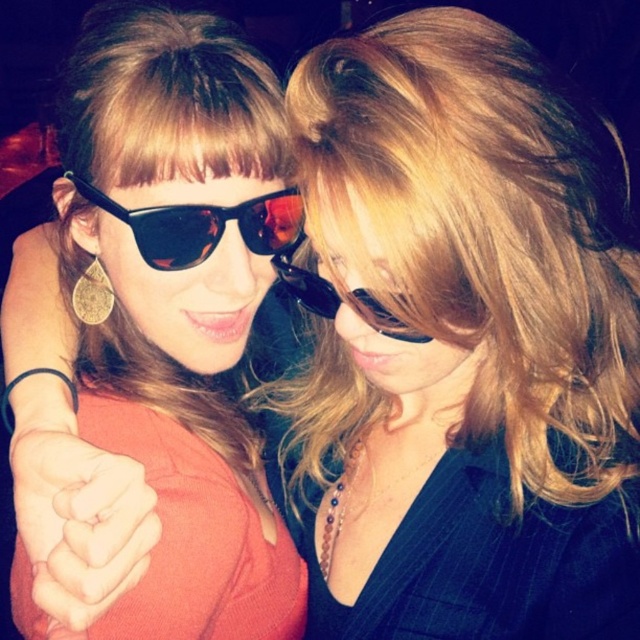
Is point (40, 516) closer to viewer compared to point (164, 253)?

Yes, it is.

Is smooth skin fist at center to the left of black reflective sunglasses at center from the viewer's perspective?

Correct, you'll find smooth skin fist at center to the left of black reflective sunglasses at center.

Between point (56, 605) and point (298, 196), which one is positioned behind?

The point (298, 196) is behind.

This screenshot has height=640, width=640. What are the coordinates of `smooth skin fist at center` in the screenshot? It's located at pyautogui.click(x=80, y=520).

Is the position of matte black sunglasses at upper left less distant than that of black reflective sunglasses at center?

That is True.

Can you confirm if matte black sunglasses at upper left is shorter than black reflective sunglasses at center?

No.

Does point (80, 188) come closer to viewer compared to point (257, 220)?

Yes, point (80, 188) is closer to viewer.

This screenshot has width=640, height=640. Find the location of `matte black sunglasses at upper left`. matte black sunglasses at upper left is located at coordinates (179, 305).

Is matte black sunglasses at upper left to the right of black plastic sunglasses at center from the viewer's perspective?

No, matte black sunglasses at upper left is not to the right of black plastic sunglasses at center.

Can you confirm if matte black sunglasses at upper left is taller than black plastic sunglasses at center?

Indeed, matte black sunglasses at upper left has a greater height compared to black plastic sunglasses at center.

Who is more distant from viewer, (88, 355) or (394, 333)?

The point (88, 355) is behind.

At what (x,y) coordinates should I click in order to perform the action: click on matte black sunglasses at upper left. Please return your answer as a coordinate pair (x, y). The image size is (640, 640). Looking at the image, I should click on [x=179, y=305].